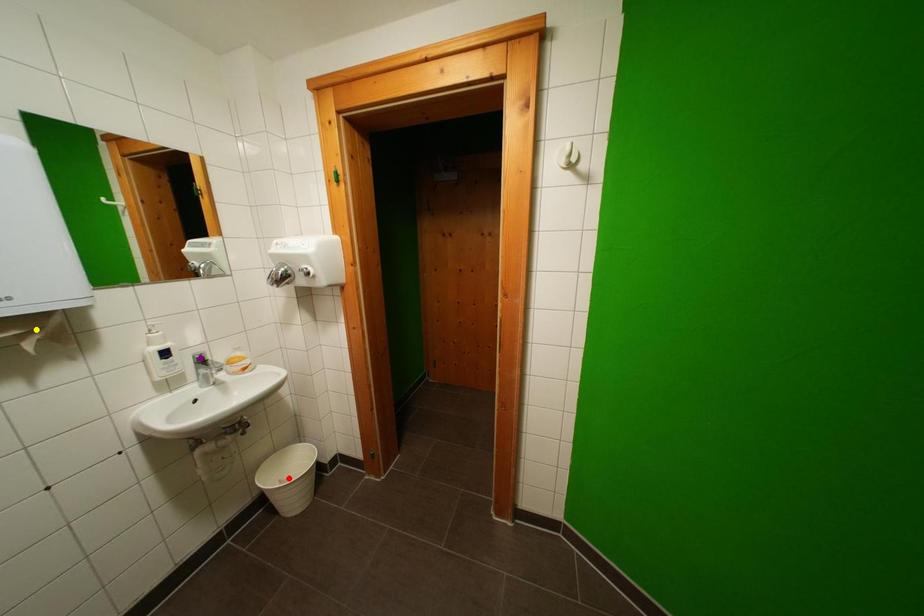
Order these from nearest to farthest:
A) red point
B) yellow point
C) purple point

red point
purple point
yellow point